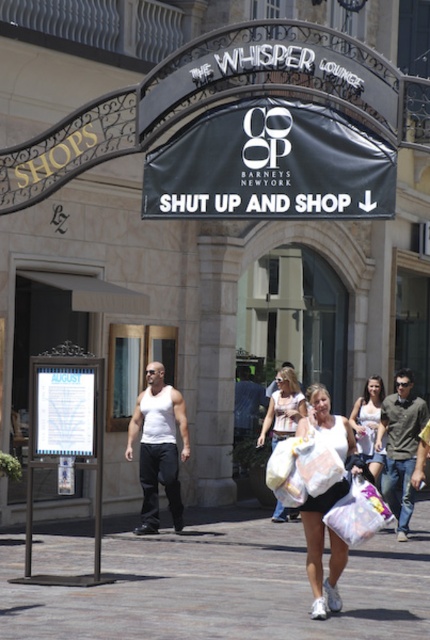
Does white matte plastic bag at center appear over white cotton tank top at center?

No.

Is the position of white matte plastic bag at center more distant than that of white cotton tank top at center?

No, it is in front of white cotton tank top at center.

Is point (340, 556) closer to camera compared to point (380, 451)?

That is True.

Locate an element on the screen. white matte plastic bag at center is located at coordinates (322, 550).

Is point (202, 600) closer to viewer compared to point (137, 413)?

Yes.

Is point (248, 627) positioned behind point (154, 406)?

No, (248, 627) is in front of (154, 406).

This screenshot has height=640, width=430. What are the coordinates of `gray concrete pavement at lower center` in the screenshot? It's located at (226, 588).

Does gray concrete pavement at lower center lie behind white matte plastic bag at center?

No, it is in front of white matte plastic bag at center.

Describe the element at coordinates (226, 588) in the screenshot. I see `gray concrete pavement at lower center` at that location.

Is point (86, 540) closer to viewer compared to point (312, 422)?

No.

What are the coordinates of `gray concrete pavement at lower center` in the screenshot? It's located at 226,588.